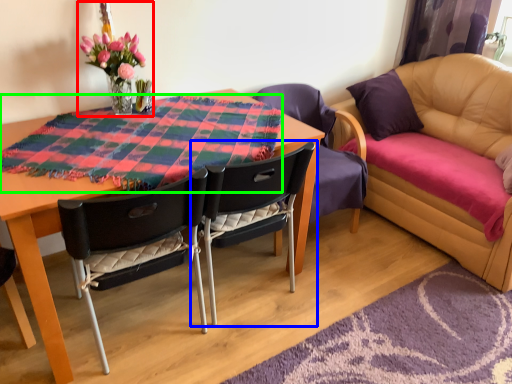
Question: Based on their relative distances, which object is farther from floral arrangement (highlighted by a red box)? Choose from chair (highlighted by a blue box) and cloth (highlighted by a green box).

Choices:
 (A) chair
 (B) cloth

Answer: (A)